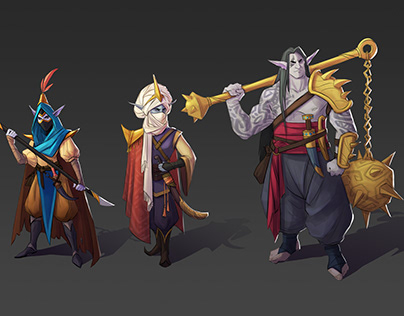
Where is `floor`? This screenshot has height=316, width=404. floor is located at coordinates 224,265.